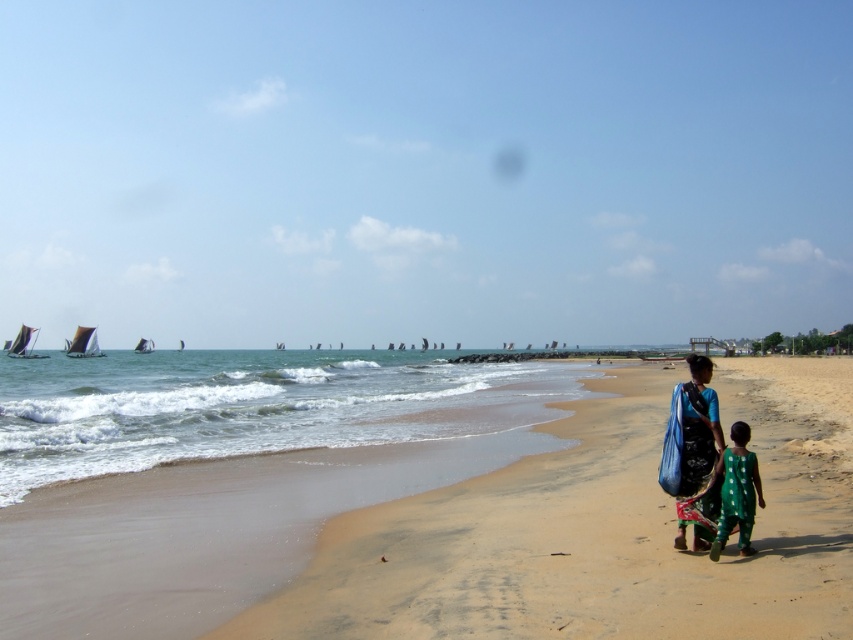
Question: Does sandy beach at lower right appear on the left side of green dotted dress at lower right?

Choices:
 (A) no
 (B) yes

Answer: (A)

Question: Observing the image, what is the correct spatial positioning of sandy beach at lower right in reference to green dotted dress at lower right?

Choices:
 (A) below
 (B) above

Answer: (A)

Question: Based on their relative distances, which object is nearer to the sandy beach at lower right?

Choices:
 (A) blue fabric bag at center-right
 (B) green dotted dress at lower right

Answer: (B)

Question: Which point appears farthest from the camera in this image?

Choices:
 (A) (711, 476)
 (B) (624, 580)
 (C) (752, 552)

Answer: (C)

Question: Does sandy beach at lower right appear over green dotted dress at lower right?

Choices:
 (A) no
 (B) yes

Answer: (A)

Question: Among these points, which one is nearest to the camera?

Choices:
 (A) (622, 556)
 (B) (762, 500)
 (C) (695, 518)

Answer: (B)